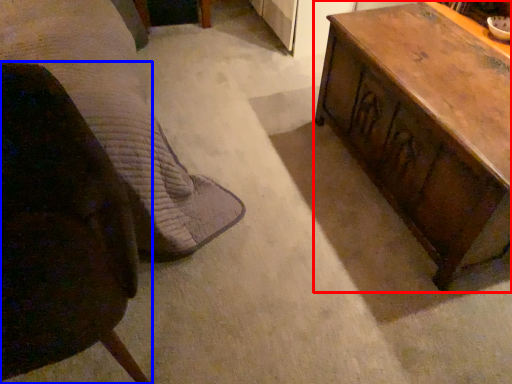
Question: Among these objects, which one is farthest to the camera, table (highlighted by a red box) or chair (highlighted by a blue box)?

Choices:
 (A) table
 (B) chair

Answer: (A)